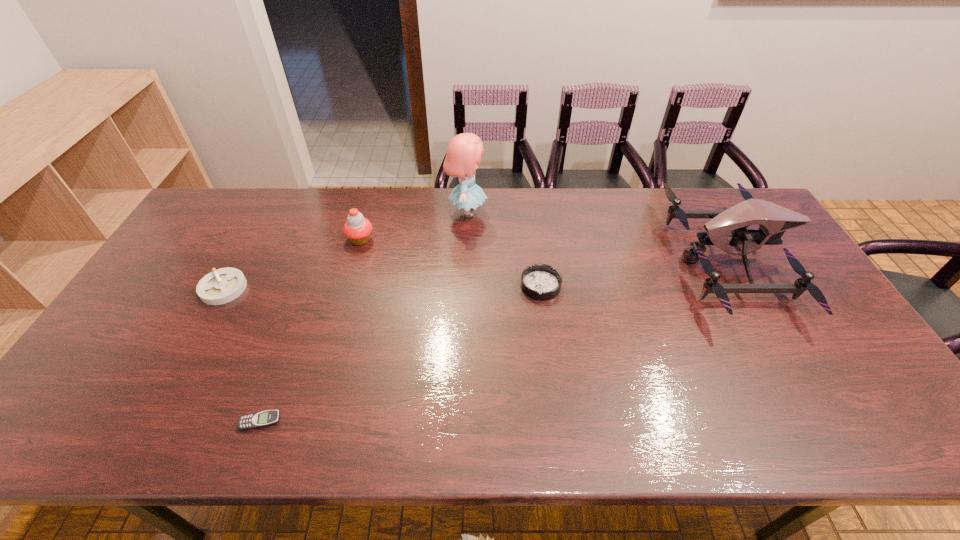
Image resolution: width=960 pixels, height=540 pixels. Identify the location of vacant area that lies between the fourth shortest object and the doll. (414, 226).

Identify which object is the fifth closest to the right ashtray. Please provide its 2D coordinates. Your answer should be formatted as a tuple, i.e. [(x, y)], where the tuple contains the x and y coordinates of a point satisfying the conditions above.

[(223, 285)]

Select which object appears as the fifth closest to the fourth object from right to left. Please provide its 2D coordinates. Your answer should be formatted as a tuple, i.e. [(x, y)], where the tuple contains the x and y coordinates of a point satisfying the conditions above.

[(774, 220)]

This screenshot has height=540, width=960. What are the coordinates of `free region that satisfies the following two spatial constraints: 1. on the front-facing side of the tallest object; 2. on the left side of the right ashtray` in the screenshot? It's located at (465, 286).

Locate an element on the screen. This screenshot has width=960, height=540. vacant region that satisfies the following two spatial constraints: 1. on the front-facing side of the third object from right to left; 2. on the left side of the second object from right to left is located at coordinates (465, 286).

The image size is (960, 540). Find the location of `free space that satisfies the following two spatial constraints: 1. on the front side of the fourth shortest object; 2. on the left side of the fifth object from left to right`. free space that satisfies the following two spatial constraints: 1. on the front side of the fourth shortest object; 2. on the left side of the fifth object from left to right is located at coordinates pos(348,286).